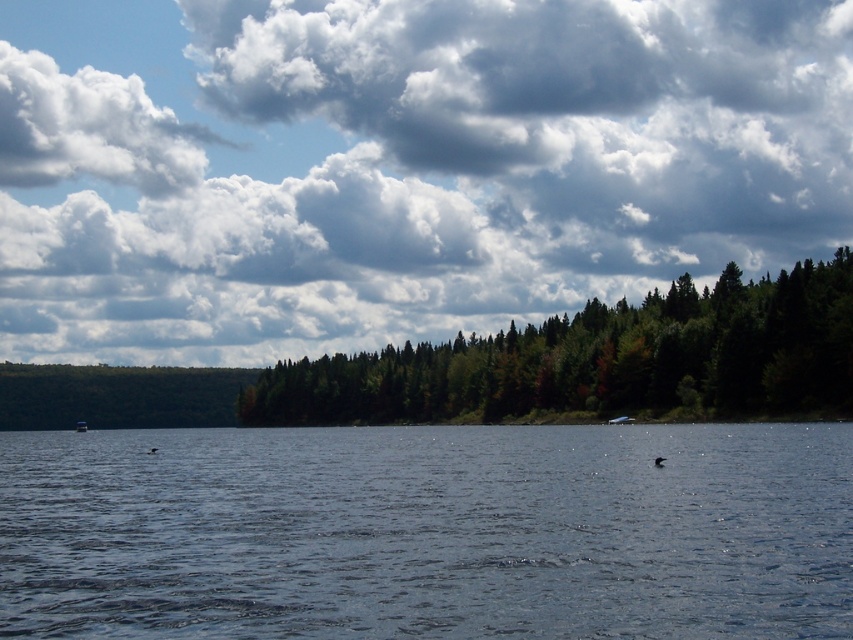
Question: Is blue water at center to the left of blue glossy boat at center from the viewer's perspective?

Choices:
 (A) no
 (B) yes

Answer: (B)

Question: Is blue water at center thinner than green matte forest at center?

Choices:
 (A) no
 (B) yes

Answer: (B)

Question: Which point is closer to the camera?

Choices:
 (A) (625, 419)
 (B) (370, 179)
 (C) (479, 412)
 (D) (531, 588)

Answer: (D)

Question: Does cloudy sky at upper center have a lesser width compared to green matte forest at center?

Choices:
 (A) yes
 (B) no

Answer: (B)

Question: Which of the following is the closest to the observer?

Choices:
 (A) green matte forest at center
 (B) cloudy sky at upper center
 (C) blue glossy boat at center

Answer: (A)

Question: Which point appears farthest from the camera in this image?

Choices:
 (A) (80, 432)
 (B) (74, 157)

Answer: (B)